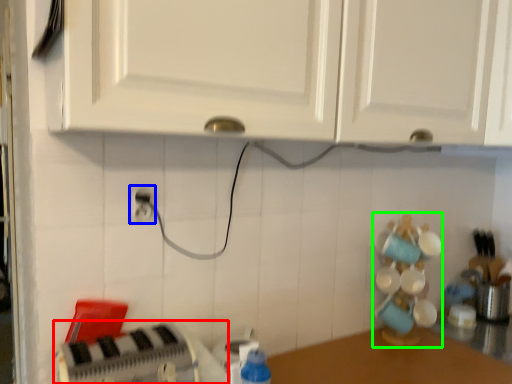
Question: Estimate the real-world distances between objects in this image. Which object is farther from appliance (highlighted by a red box), electric outlet (highlighted by a blue box) or toy (highlighted by a green box)?

Choices:
 (A) electric outlet
 (B) toy

Answer: (B)